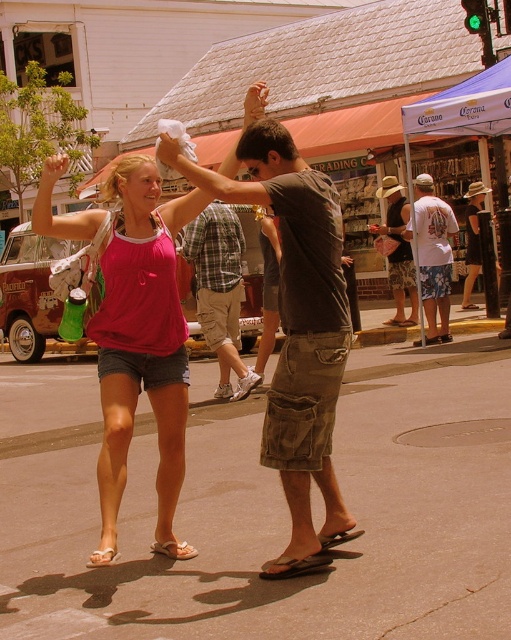
Can you confirm if cotton plaid shirt at center is positioned to the right of white cotton t-shirt at center?

In fact, cotton plaid shirt at center is to the left of white cotton t-shirt at center.

Does cotton plaid shirt at center appear over white cotton t-shirt at center?

No, cotton plaid shirt at center is not above white cotton t-shirt at center.

Does point (199, 298) come in front of point (428, 328)?

Yes, point (199, 298) is in front of point (428, 328).

This screenshot has height=640, width=511. Find the location of `cotton plaid shirt at center`. cotton plaid shirt at center is located at coordinates (220, 291).

How distant is pink fabric tank top at center from cotton plaid shirt at center?

A distance of 3.39 meters exists between pink fabric tank top at center and cotton plaid shirt at center.

Which is more to the right, pink fabric tank top at center or cotton plaid shirt at center?

Positioned to the right is cotton plaid shirt at center.

What do you see at coordinates (142, 337) in the screenshot?
I see `pink fabric tank top at center` at bounding box center [142, 337].

Identify the location of pink fabric tank top at center. (142, 337).

Which is above, brown cargo shorts at center or white fabric sandal at lower center?

brown cargo shorts at center is higher up.

Is brown cargo shorts at center closer to the viewer compared to white fabric sandal at lower center?

No, brown cargo shorts at center is behind white fabric sandal at lower center.

This screenshot has height=640, width=511. In order to click on brown cargo shorts at center in this screenshot , I will do `click(398, 250)`.

Where is `brown cargo shorts at center`? Image resolution: width=511 pixels, height=640 pixels. brown cargo shorts at center is located at coordinates (398, 250).